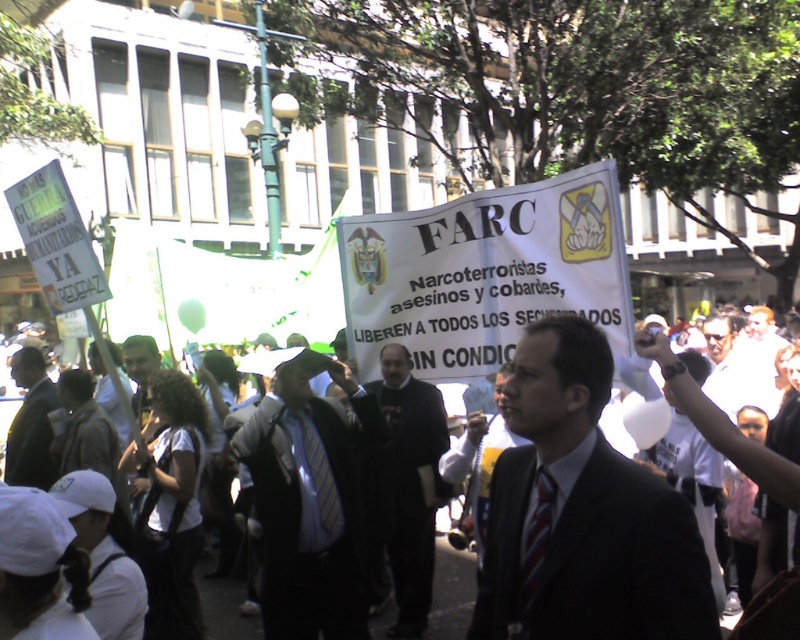
In the image of the protest scene, there are two points marked at coordinates point (390, 614) and point (48, 486). Which of these points is located further back in the scene?

Point (390, 614) is behind point (48, 486) in the scene.

You are a photographer standing at the edge of the protest. You want to capture a photo that includes both the white paper banner at center and the matte black suit at center. Given the distance between them, will you need to adjust your camera to a wider angle to fit both into the frame?

The white paper banner at center is 3.67 meters away from the matte black suit at center. To capture both in the same frame, you would need to use a wider angle lens or step back to ensure both objects are within the camera view.